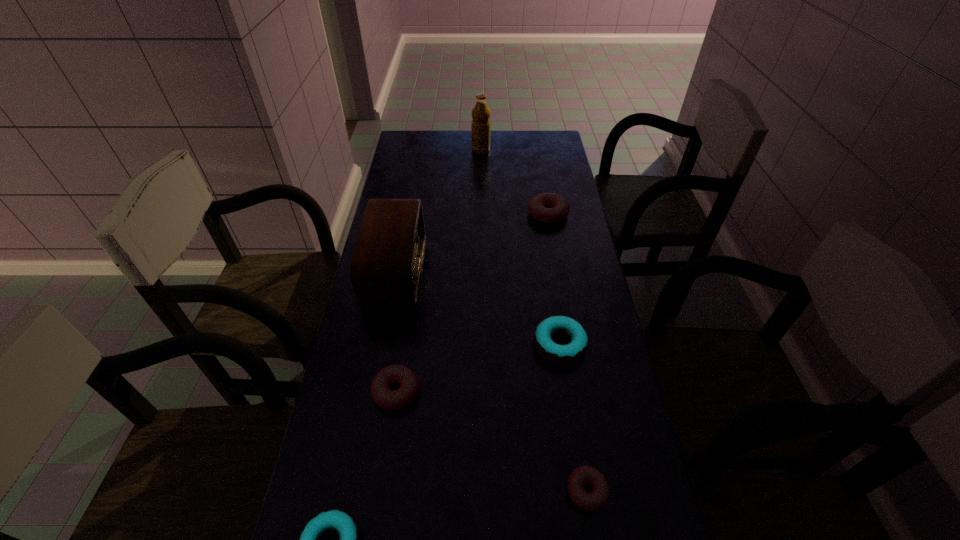
You are a GUI agent. You are given a task and a screenshot of the screen. Output one action in this format:
    pyautogui.click(x=<x>, y=<y>)
    Task: Click on the fruit juice
    The height and width of the screenshot is (540, 960).
    Given the screenshot: What is the action you would take?
    coord(480,127)

You are a GUI agent. You are given a task and a screenshot of the screen. Output one action in this format:
    pyautogui.click(x=<x>, y=<y>)
    Task: Click on the farthest object
    This screenshot has height=540, width=960.
    Given the screenshot: What is the action you would take?
    pyautogui.click(x=480, y=127)

Identify the location of the second tallest object. The image size is (960, 540). (385, 269).

Locate an element on the screen. The width and height of the screenshot is (960, 540). radio receiver is located at coordinates (385, 269).

Identify the location of the farthest pink doughnut. This screenshot has width=960, height=540. (550, 208).

Identify the location of the sixth nearest object. (550, 208).

You are a GUI agent. You are given a task and a screenshot of the screen. Output one action in this format:
    pyautogui.click(x=<x>, y=<y>)
    Task: Click on the right blue doughnut
    This screenshot has width=960, height=540.
    Given the screenshot: What is the action you would take?
    pyautogui.click(x=560, y=354)

This screenshot has width=960, height=540. I want to click on the fourth farthest object, so click(x=560, y=354).

You are a GUI agent. You are given a task and a screenshot of the screen. Output one action in this format:
    pyautogui.click(x=<x>, y=<y>)
    Task: Click on the second farthest pink doughnut
    
    Given the screenshot: What is the action you would take?
    pyautogui.click(x=385, y=398)

Locate an element on the screen. the second smallest pink doughnut is located at coordinates (385, 398).